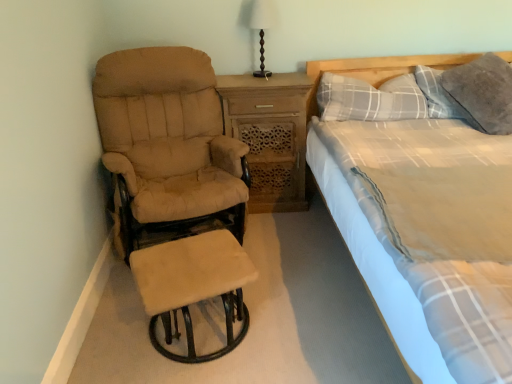
You are a GUI agent. You are given a task and a screenshot of the screen. Output one action in this format:
    pyautogui.click(x=<x>, y=<y>)
    Task: Click on the free location in front of wooden nightstand at center
    The width and height of the screenshot is (512, 384).
    Given the screenshot: What is the action you would take?
    pyautogui.click(x=284, y=233)